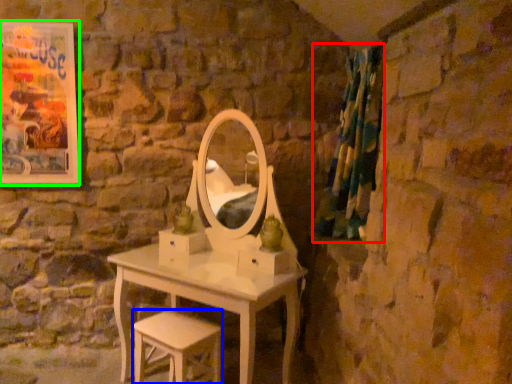
Question: Considering the real-world distances, which object is farthest from curtain (highlighted by a red box)? stool (highlighted by a blue box) or picture frame (highlighted by a green box)?

Choices:
 (A) stool
 (B) picture frame

Answer: (B)